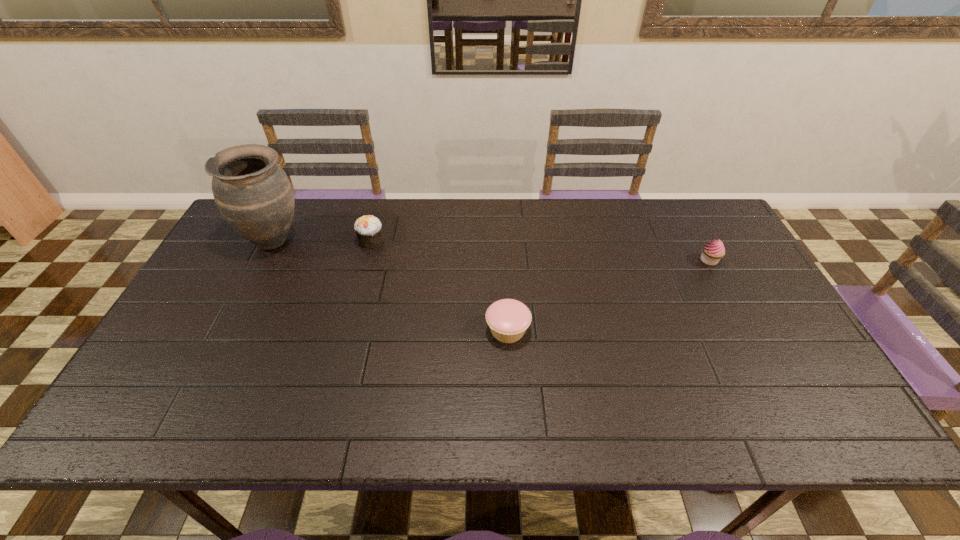
Identify the location of vacant space at the far right corner of the desktop. (715, 229).

Locate an element on the screen. This screenshot has width=960, height=540. free point at the near right corner is located at coordinates (773, 425).

This screenshot has height=540, width=960. Identify the location of blank region between the second nearest cupcake and the tallest object. (492, 251).

Find the location of `vacant space that is in between the leftmost cupcake and the tallest object`. vacant space that is in between the leftmost cupcake and the tallest object is located at coordinates (323, 240).

Image resolution: width=960 pixels, height=540 pixels. In order to click on empty location between the farthest cupcake and the urn in this screenshot , I will do `click(323, 240)`.

At what (x,y) coordinates should I click in order to perform the action: click on free space between the rightmost object and the leftmost object. Please return your answer as a coordinate pair (x, y). Looking at the image, I should click on (492, 251).

In order to click on vacant area that lies between the rightmost object and the farthest cupcake in this screenshot , I will do `click(540, 251)`.

The image size is (960, 540). In order to click on empty space that is in between the rightmost object and the leftmost cupcake in this screenshot , I will do `click(540, 251)`.

Locate an element on the screen. Image resolution: width=960 pixels, height=540 pixels. free spot between the urn and the rightmost cupcake is located at coordinates (492, 251).

Identify the location of vacant area between the second farthest cupcake and the shortest object. (609, 295).